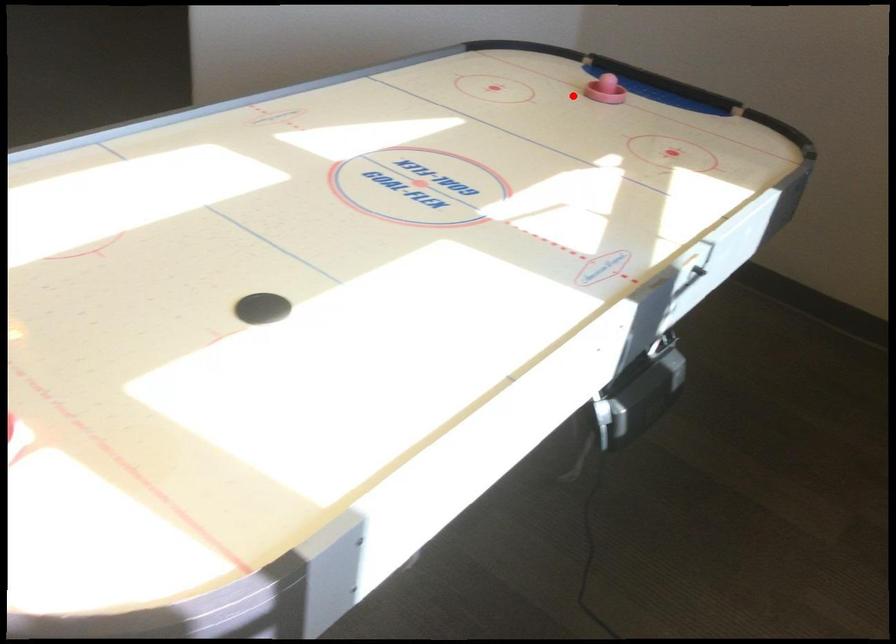
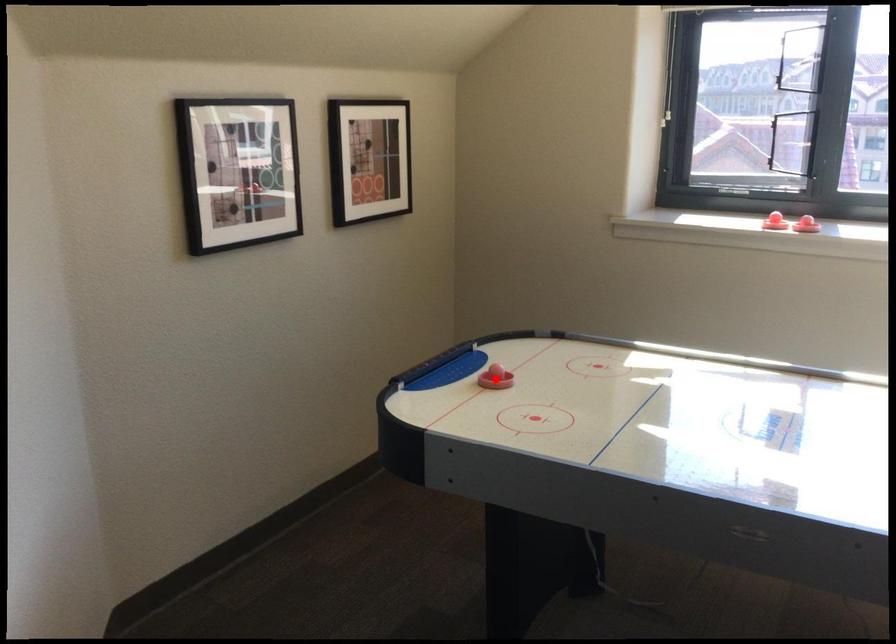
I am providing you with two images of the same scene from different viewpoints. A red point is marked on the first image and another point is marked on the second image. Is the red point in image1 aligned with the point shown in image2?

Yes